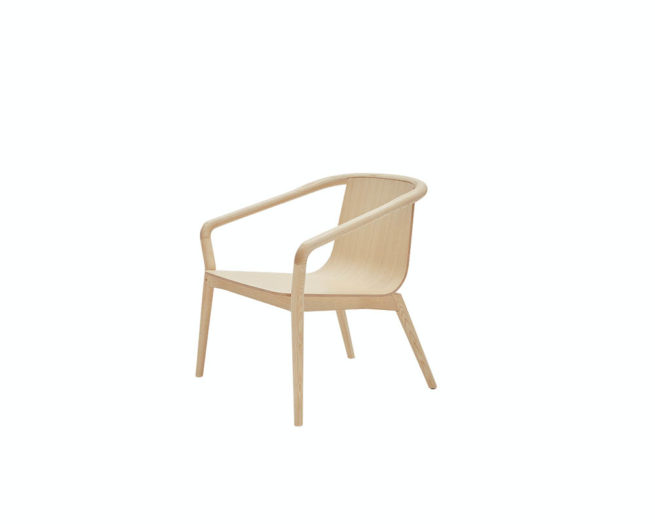
Where is `arm rests`? arm rests is located at coordinates (316, 240), (242, 211).